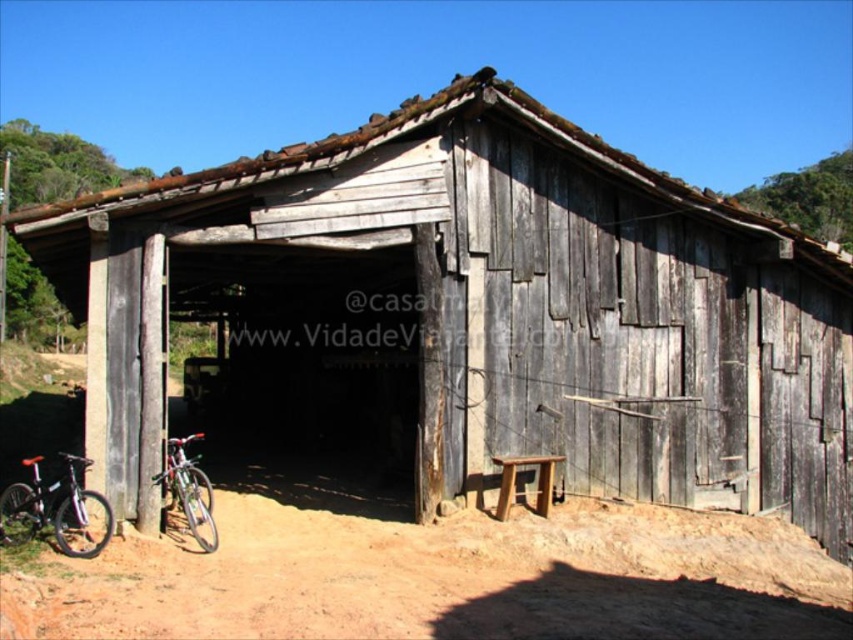
Can you confirm if brown dirt track at lower left is positioned to the right of shiny metallic bicycle at lower left?

Indeed, brown dirt track at lower left is positioned on the right side of shiny metallic bicycle at lower left.

Does brown dirt track at lower left have a smaller size compared to shiny metallic bicycle at lower left?

Yes.

Who is more distant from viewer, (442,572) or (186,472)?

Point (186,472)

I want to click on brown dirt track at lower left, so click(x=444, y=579).

Does brown dirt track at lower left have a greater width compared to shiny black bicycle at lower left?

Incorrect, brown dirt track at lower left's width does not surpass shiny black bicycle at lower left's.

Is point (572, 544) less distant than point (32, 472)?

Yes, it is in front of point (32, 472).

Identify the location of brown dirt track at lower left. This screenshot has height=640, width=853. (444, 579).

Does brown dirt track at lower left appear over wooden stool at lower center?

Actually, brown dirt track at lower left is below wooden stool at lower center.

Can you confirm if brown dirt track at lower left is smaller than wooden stool at lower center?

Yes, brown dirt track at lower left is smaller than wooden stool at lower center.

Is point (514, 573) positioned before point (529, 461)?

That is True.

What are the coordinates of `brown dirt track at lower left` in the screenshot? It's located at (444, 579).